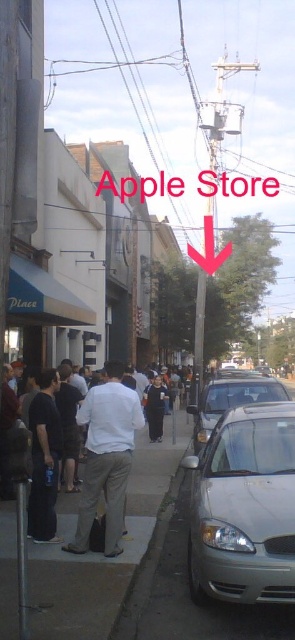
Which is more to the left, gray concrete sidewalk at lower center or white matte shirt at center?

gray concrete sidewalk at lower center

Between gray concrete sidewalk at lower center and white matte shirt at center, which one has more height?

Standing taller between the two is white matte shirt at center.

Image resolution: width=295 pixels, height=640 pixels. Identify the location of gray concrete sidewalk at lower center. (102, 554).

Which is above, gray concrete sidewalk at lower center or dark blue jeans at center?

dark blue jeans at center is above.

Who is more forward, (x=12, y=572) or (x=148, y=408)?

Positioned in front is point (x=12, y=572).

You are a GUI agent. You are given a task and a screenshot of the screen. Output one action in this format:
    pyautogui.click(x=<x>, y=<y>)
    Task: Click on the gray concrete sidewalk at lower center
    This screenshot has width=295, height=640.
    Given the screenshot: What is the action you would take?
    pyautogui.click(x=102, y=554)

Find the location of a particular element. Image resolution: width=295 pixels, height=640 pixels. gray concrete sidewalk at lower center is located at coordinates (102, 554).

Which is above, dark gray pants at center or dark blue jeans at center?

dark gray pants at center is higher up.

Does dark gray pants at center appear on the right side of dark blue jeans at center?

Incorrect, dark gray pants at center is not on the right side of dark blue jeans at center.

Between point (41, 404) and point (161, 397), which one is positioned in front?

Point (41, 404) is in front.

Locate an element on the screen. This screenshot has height=640, width=295. dark gray pants at center is located at coordinates (43, 460).